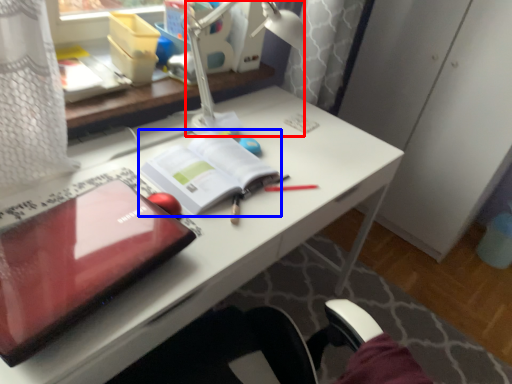
Question: Which object appears farthest to the camera in this image, lamp (highlighted by a red box) or paperback book (highlighted by a blue box)?

Choices:
 (A) lamp
 (B) paperback book

Answer: (B)